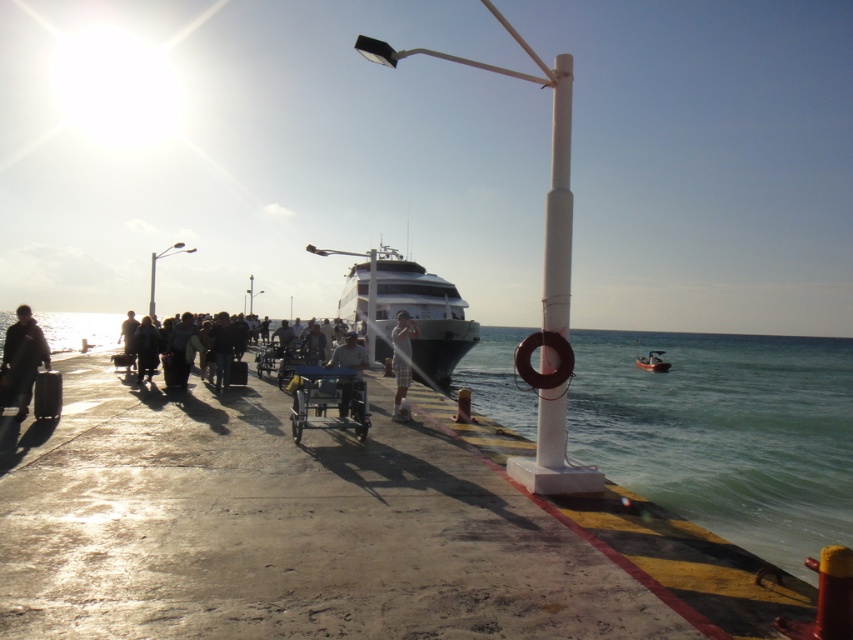
You are a photographer standing on the dock and want to take a photo of the dark clothing at center and the white plastic lamp post at center. Which object should you focus on first to ensure both are in sharp focus?

The dark clothing at center is closer to the viewer than the white plastic lamp post at center. To ensure both are in sharp focus, you should focus on the white plastic lamp post at center because focusing on the farther object extends the depth of field to include the closer one.

You are standing on the concrete dock with the yellow and black striped edge. You see a point at coordinates (x=408, y=312). What object is located at this point?

The shiny white yacht at center is located at point (x=408, y=312).